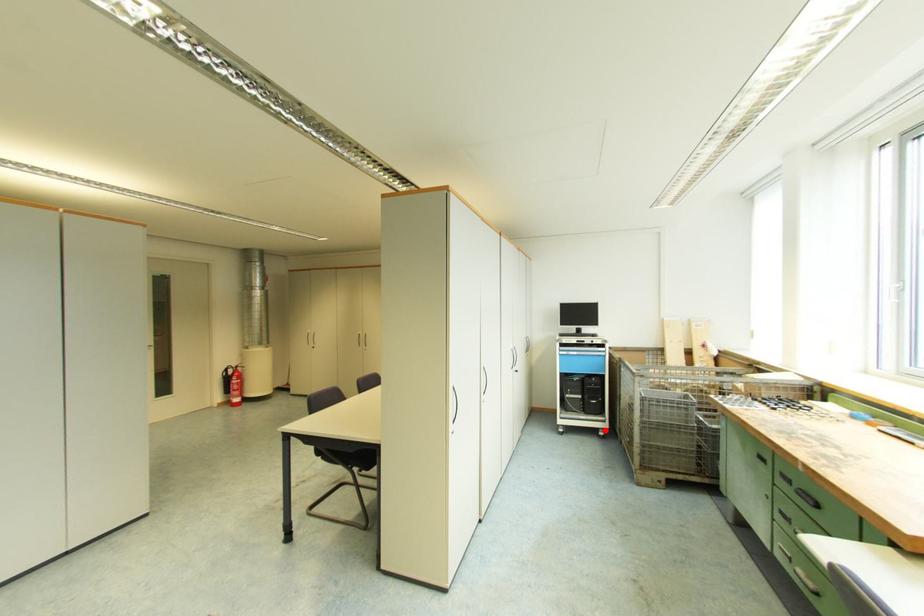
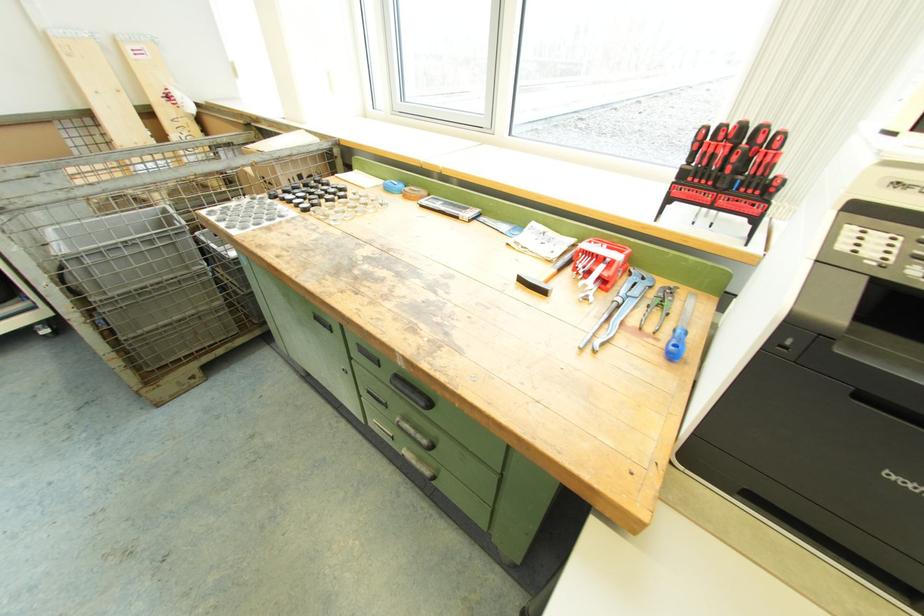
Question: A red point is marked in image1. In image2, is the corresponding 3D point closer to the camera or farther? Reply with the corresponding letter.

Choices:
 (A) The corresponding 3D point is closer.
 (B) The corresponding 3D point is farther.

Answer: (A)